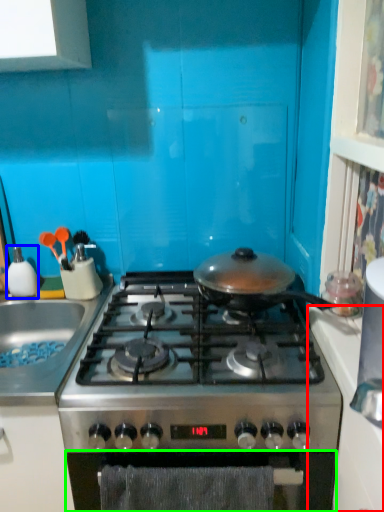
Question: Considering the real-world distances, which object is farthest from counter top (highlighted by a red box)? kitchen appliance (highlighted by a blue box) or oven (highlighted by a green box)?

Choices:
 (A) kitchen appliance
 (B) oven

Answer: (A)